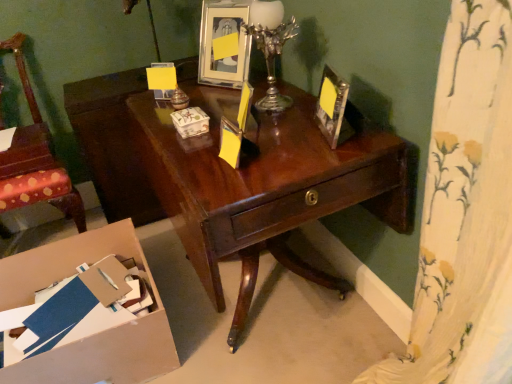
At what (x,y) coordinates should I click in order to perform the action: click on vacant space situated on the left part of silver metallic candle holder at upper right. Please return your answer as a coordinate pair (x, y). The image size is (512, 384). Looking at the image, I should click on (222, 112).